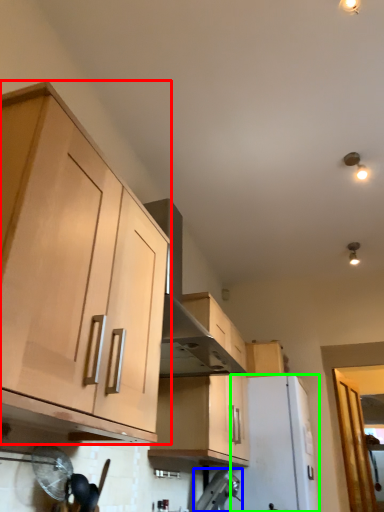
Question: Which object is positioned farthest from cabinetry (highlighted by a red box)? Select from appliance (highlighted by a blue box) and appliance (highlighted by a green box).

Choices:
 (A) appliance
 (B) appliance

Answer: (B)